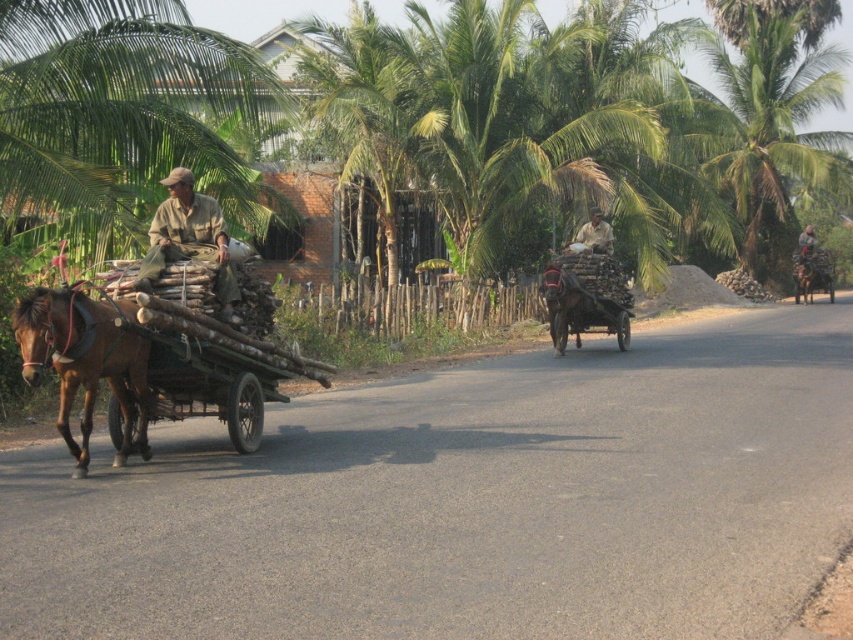
You are a photographer standing on the side of the road. You want to take a picture of the brown cotton shirt at left and the wooden cart at center. Which object should you zoom in on first to ensure both are in focus?

The brown cotton shirt at left has a smaller size compared to wooden cart at center. Therefore, you should zoom in on the wooden cart at center first since it is larger and will require more focus adjustment.

You are a photographer standing at the origin point of the image. You want to capture a photo of the brown glossy horse at left. What are the coordinates of the horse?

The coordinates of the brown glossy horse at left are at point (85, 362).

You are a photographer trying to capture both the brown glossy horse at left and the khaki cotton shirt at center in a single shot. Considering their sizes, which object should you focus on first to ensure it appears larger in the photo?

The brown glossy horse at left is bigger than the khaki cotton shirt at center, so you should focus on the brown glossy horse at left first to ensure it appears larger in the photo.